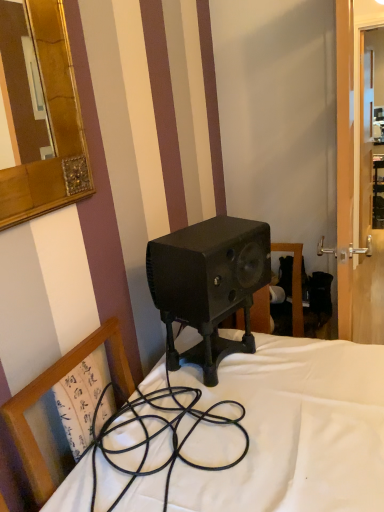
This screenshot has height=512, width=384. Describe the element at coordinates (48, 390) in the screenshot. I see `wooden chair at center` at that location.

In order to face transparent glass door at right, should I rotate leftwards or rightwards?

A 20.505 degree turn to the right will do.

Identify the location of wooden chair at center. (48, 390).

Identify the location of speaker in front of the transparent glass door at right. The image size is (384, 512). (208, 285).

From the image's perspective, which object appears higher, matte black speaker at center or transparent glass door at right?

transparent glass door at right appears higher in the image.

Considering the sizes of objects matte black speaker at center and transparent glass door at right in the image provided, who is thinner, matte black speaker at center or transparent glass door at right?

With smaller width is transparent glass door at right.

Who is smaller, matte black speaker at center or transparent glass door at right?

matte black speaker at center.

Considering the positions of objects wooden chair at center and matte black speaker at center in the image provided, who is more to the left, wooden chair at center or matte black speaker at center?

Positioned to the left is wooden chair at center.

Can you confirm if wooden chair at center is wider than matte black speaker at center?

Yes.

Is wooden chair at center not inside matte black speaker at center?

wooden chair at center lies outside matte black speaker at center's area.

From a real-world perspective, is wooden chair at center above or below matte black speaker at center?

wooden chair at center is below matte black speaker at center.

Is transparent glass door at right facing towards wooden chair at center?

No.

Consider the image. Is transparent glass door at right directly adjacent to wooden chair at center?

transparent glass door at right and wooden chair at center are clearly separated.

Is transparent glass door at right positioned before wooden chair at center?

No, transparent glass door at right is further to the viewer.

Can you tell me how much transparent glass door at right and wooden chair at center differ in facing direction?

There is a 5.16-degree angle between the facing directions of transparent glass door at right and wooden chair at center.

From the image's perspective, is wooden chair at center over transparent glass door at right?

No, from the image's perspective, wooden chair at center is not on top of transparent glass door at right.

Would you say wooden chair at center is a long distance from transparent glass door at right?

wooden chair at center is near transparent glass door at right, not far away.

Does wooden chair at center have a larger size compared to transparent glass door at right?

No.

Consider the image. Considering the sizes of objects wooden chair at center and transparent glass door at right in the image provided, who is wider, wooden chair at center or transparent glass door at right?

wooden chair at center is wider.

Is matte black speaker at center bigger than wooden chair at center?

No, matte black speaker at center is not bigger than wooden chair at center.

Which is more to the right, matte black speaker at center or wooden chair at center?

From the viewer's perspective, matte black speaker at center appears more on the right side.

Considering the positions of objects matte black speaker at center and wooden chair at center in the image provided, who is in front, matte black speaker at center or wooden chair at center?

Positioned in front is wooden chair at center.

Is matte black speaker at center oriented towards wooden chair at center?

No, matte black speaker at center is not oriented towards wooden chair at center.

From the image's perspective, is transparent glass door at right above or below matte black speaker at center?

Clearly, from the image's perspective, transparent glass door at right is above matte black speaker at center.

Is transparent glass door at right surrounding matte black speaker at center?

No, matte black speaker at center is located outside of transparent glass door at right.

How much distance is there between transparent glass door at right and matte black speaker at center?

18.21 inches.

Between transparent glass door at right and matte black speaker at center, which one has smaller size?

matte black speaker at center is smaller.

This screenshot has width=384, height=512. What are the coordinates of `screen door behind the matte black speaker at center` in the screenshot? It's located at (349, 110).

This screenshot has width=384, height=512. Identify the location of speaker on the right of wooden chair at center. (208, 285).

When comparing their distances from matte black speaker at center, does wooden chair at center or transparent glass door at right seem further?

The object further to matte black speaker at center is transparent glass door at right.

Considering their positions, is transparent glass door at right positioned further to wooden chair at center than matte black speaker at center?

transparent glass door at right is further to wooden chair at center.

Which object lies further to the anchor point wooden chair at center, matte black speaker at center or transparent glass door at right?

Based on the image, transparent glass door at right appears to be further to wooden chair at center.

When comparing their distances from transparent glass door at right, does matte black speaker at center or wooden chair at center seem closer?

Based on the image, matte black speaker at center appears to be nearer to transparent glass door at right.

When comparing their distances from matte black speaker at center, does transparent glass door at right or wooden chair at center seem further?

transparent glass door at right lies further to matte black speaker at center than the other object.

Consider the image. Estimate the real-world distances between objects in this image. Which object is further from transparent glass door at right, wooden chair at center or matte black speaker at center?

The object further to transparent glass door at right is wooden chair at center.

This screenshot has height=512, width=384. I want to click on speaker between transparent glass door at right and wooden chair at center in the up-down direction, so click(208, 285).